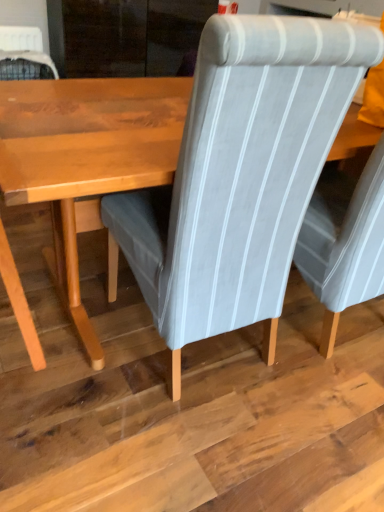
This screenshot has width=384, height=512. Identify the location of light gray fabric chair at center. (239, 176).

What do you see at coordinates (239, 176) in the screenshot? The height and width of the screenshot is (512, 384). I see `light gray fabric chair at center` at bounding box center [239, 176].

In order to face light gray fabric chair at center, should I rotate leftwards or rightwards?

Turn right approximately 1.456 degrees to face it.

Locate an element on the screen. This screenshot has width=384, height=512. light gray fabric chair at center is located at coordinates (239, 176).